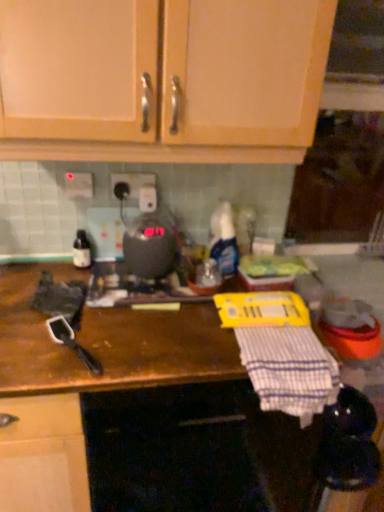
The height and width of the screenshot is (512, 384). I want to click on free space above white checkered cloth at lower right (from a real-world perspective), so click(284, 345).